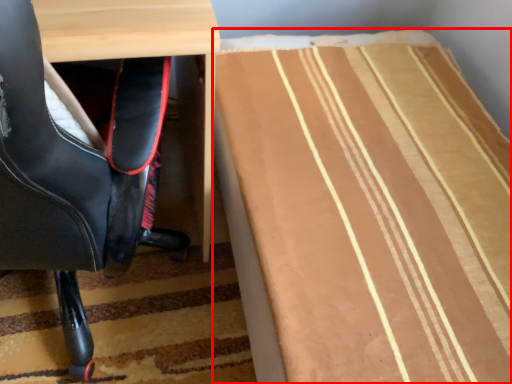
Question: Where is table (annotated by the red box) located in relation to chair in the image?

Choices:
 (A) right
 (B) left

Answer: (A)